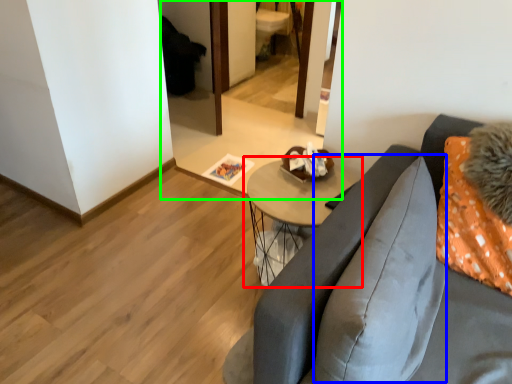
Question: Which is nearer to the table (highlighted by a red box)? pillow (highlighted by a blue box) or mirror (highlighted by a green box).

Choices:
 (A) pillow
 (B) mirror

Answer: (A)